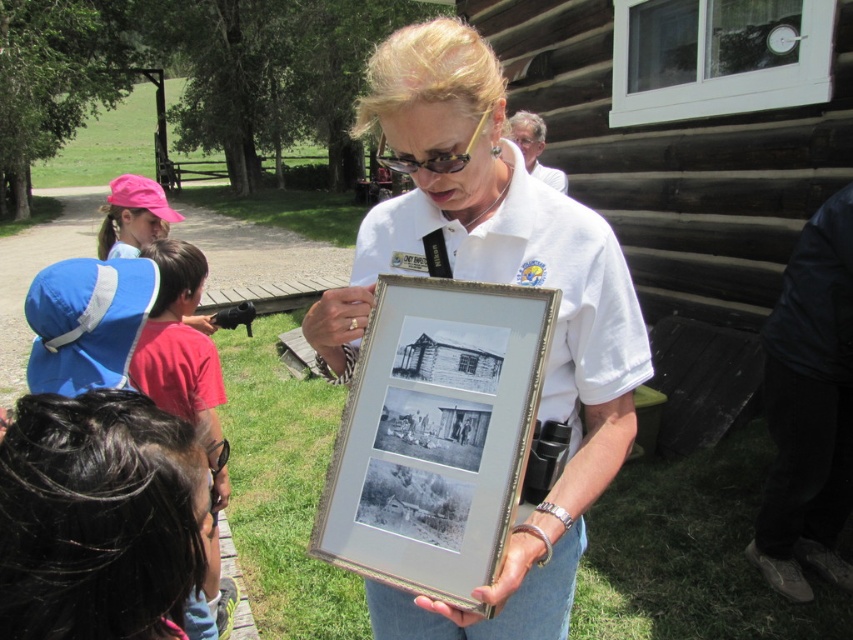
You are a photographer trying to capture a clear shot of the metallic frame at center and the matte white shirt at upper center. Based on their positions, which object should you focus on first to ensure both are in frame?

The metallic frame at center is positioned on the left side of matte white shirt at upper center, so you should focus on the metallic frame at center first to ensure both are in frame.

You are standing at point A which is at coordinates point (456, 237) and want to walk to point B at coordinates point (561, 182). According to the scene, which direction should you move relative to your current position?

You should move backward because point (456, 237) is in front of point (561, 182), meaning point B is behind you relative to your current position at point A.

You are a photographer trying to capture a clear shot of the metallic frame at center. Based on the coordinates provided, where should you position your camera to ensure the frame is centered in your shot?

The metallic frame at center is located at coordinates point (492,282), so positioning the camera directly facing this coordinate will ensure the frame is centered in the shot.